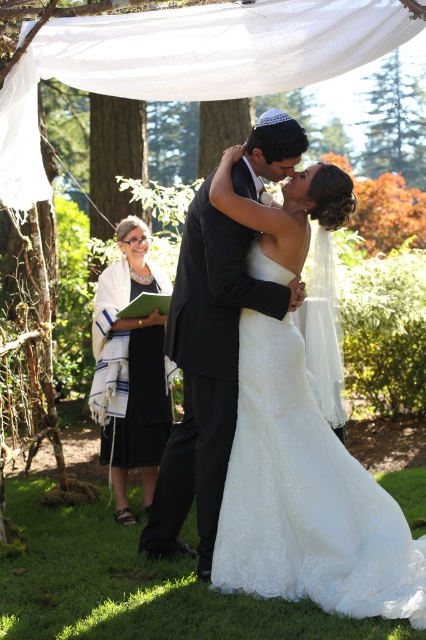
Question: Does matte black suit at center have a larger size compared to black wool shawl at left?

Choices:
 (A) yes
 (B) no

Answer: (A)

Question: From the image, what is the correct spatial relationship of white lace dress at center in relation to black wool shawl at left?

Choices:
 (A) below
 (B) above

Answer: (A)

Question: Estimate the real-world distances between objects in this image. Which object is closer to the black wool shawl at left?

Choices:
 (A) white lace dress at center
 (B) matte black suit at center

Answer: (B)

Question: Does white lace dress at center appear on the right side of matte black suit at center?

Choices:
 (A) yes
 (B) no

Answer: (A)

Question: Estimate the real-world distances between objects in this image. Which object is farther from the black wool shawl at left?

Choices:
 (A) matte black suit at center
 (B) white lace dress at center

Answer: (B)

Question: Which point is closer to the camera?

Choices:
 (A) (150, 486)
 (B) (288, 211)
 (C) (198, 304)

Answer: (B)